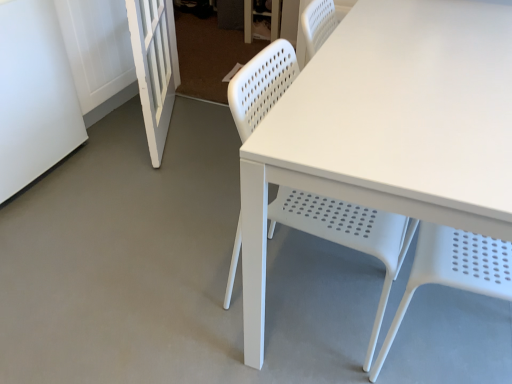
This screenshot has height=384, width=512. What are the coordinates of `white plastic chair at center` in the screenshot? It's located at (349, 235).

Find the location of a particular element. The image size is (512, 384). white matte screen door at left, positioned as the second screen door in left-to-right order is located at coordinates (154, 67).

Is point (285, 78) positioned after point (39, 109)?

No, it is in front of (39, 109).

From the image's perspective, does white plastic chair at center appear lower than white matte screen door at left, the first screen door positioned from the left?

Indeed, from the image's perspective, white plastic chair at center is shown beneath white matte screen door at left, the first screen door positioned from the left.

From a real-world perspective, is white plastic chair at center above or below white matte screen door at left, the first screen door positioned from the left?

white plastic chair at center is situated higher than white matte screen door at left, the first screen door positioned from the left, in the real world.

Does white plastic chair at center appear on the left side of white matte screen door at left, which appears as the 2th screen door when viewed from the right?

No.

Relative to white plastic chair at center, is white matte screen door at left, positioned as the second screen door in left-to-right order, in front or behind?

In the image, white matte screen door at left, positioned as the second screen door in left-to-right order, appears behind white plastic chair at center.

What's the angular difference between white matte screen door at left, the 1th screen door viewed from the right, and white plastic chair at center's facing directions?

The angular difference between white matte screen door at left, the 1th screen door viewed from the right, and white plastic chair at center is 24.4 degrees.

Based on the photo, from a real-world perspective, is white matte screen door at left, the 1th screen door viewed from the right, below white plastic chair at center?

Yes.

Does white matte screen door at left, the 1th screen door viewed from the right, touch white plastic chair at center?

They are not placed beside each other.

Is white matte screen door at left, the first screen door positioned from the left, closer to camera compared to white matte screen door at left, the 1th screen door viewed from the right?

Yes.

Measure the distance from white matte screen door at left, which appears as the 2th screen door when viewed from the right, to white matte screen door at left, positioned as the second screen door in left-to-right order.

white matte screen door at left, which appears as the 2th screen door when viewed from the right, and white matte screen door at left, positioned as the second screen door in left-to-right order, are 17.37 inches apart.

Does white matte screen door at left, the first screen door positioned from the left, have a smaller size compared to white matte screen door at left, the 1th screen door viewed from the right?

No, white matte screen door at left, the first screen door positioned from the left, is not smaller than white matte screen door at left, the 1th screen door viewed from the right.

From the image's perspective, does white matte screen door at left, which appears as the 2th screen door when viewed from the right, appear higher than white matte screen door at left, positioned as the second screen door in left-to-right order?

No, from the image's perspective, white matte screen door at left, which appears as the 2th screen door when viewed from the right, is not above white matte screen door at left, positioned as the second screen door in left-to-right order.

Does point (145, 92) come farther from viewer compared to point (11, 127)?

Yes, it is.

Based on the photo, would you say white matte screen door at left, positioned as the second screen door in left-to-right order, contains white matte screen door at left, the first screen door positioned from the left?

No, white matte screen door at left, positioned as the second screen door in left-to-right order, does not contain white matte screen door at left, the first screen door positioned from the left.

Is white matte screen door at left, the 1th screen door viewed from the right, turned away from white matte screen door at left, which appears as the 2th screen door when viewed from the right?

Absolutely, white matte screen door at left, the 1th screen door viewed from the right, is directed away from white matte screen door at left, which appears as the 2th screen door when viewed from the right.

Measure the distance between white matte screen door at left, the 1th screen door viewed from the right, and white matte screen door at left, the first screen door positioned from the left.

They are 17.37 inches apart.

Considering the points (292, 75) and (161, 115), which point is behind, point (292, 75) or point (161, 115)?

The point (161, 115) is farther.

Does white plastic chair at center have a smaller size compared to white matte screen door at left, positioned as the second screen door in left-to-right order?

Actually, white plastic chair at center might be larger than white matte screen door at left, positioned as the second screen door in left-to-right order.

Considering the positions of objects white plastic chair at center and white matte screen door at left, the 1th screen door viewed from the right, in the image provided, who is more to the left, white plastic chair at center or white matte screen door at left, the 1th screen door viewed from the right,?

Positioned to the left is white matte screen door at left, the 1th screen door viewed from the right.

Is white plastic chair at center outside of white matte screen door at left, positioned as the second screen door in left-to-right order?

Yes, white plastic chair at center is outside of white matte screen door at left, positioned as the second screen door in left-to-right order.

Image resolution: width=512 pixels, height=384 pixels. I want to click on chair on the right of white matte screen door at left, which appears as the 2th screen door when viewed from the right, so click(349, 235).

Relative to white plastic chair at center, is white matte screen door at left, which appears as the 2th screen door when viewed from the right, in front or behind?

Clearly, white matte screen door at left, which appears as the 2th screen door when viewed from the right, is behind white plastic chair at center.

Does point (78, 139) come closer to viewer compared to point (308, 193)?

No, it is not.

Considering the relative sizes of white matte screen door at left, the first screen door positioned from the left, and white plastic chair at center in the image provided, is white matte screen door at left, the first screen door positioned from the left, taller than white plastic chair at center?

In fact, white matte screen door at left, the first screen door positioned from the left, may be shorter than white plastic chair at center.

You are a GUI agent. You are given a task and a screenshot of the screen. Output one action in this format:
    pyautogui.click(x=<x>, y=<y>)
    Task: Click on the 1st screen door behind the white plastic chair at center
    This screenshot has height=384, width=512.
    Given the screenshot: What is the action you would take?
    pyautogui.click(x=34, y=95)

From a real-world perspective, which screen door is the 1st one underneath the white plastic chair at center? Please provide its 2D coordinates.

[(154, 67)]

Looking at the image, which one is located further to white matte screen door at left, positioned as the second screen door in left-to-right order, white plastic chair at center or white matte screen door at left, the first screen door positioned from the left?

Based on the image, white plastic chair at center appears to be further to white matte screen door at left, positioned as the second screen door in left-to-right order.

Considering their positions, is white matte screen door at left, the first screen door positioned from the left, positioned further to white plastic chair at center than white matte screen door at left, positioned as the second screen door in left-to-right order?

Based on the image, white matte screen door at left, the first screen door positioned from the left, appears to be further to white plastic chair at center.

Which object lies nearer to the anchor point white matte screen door at left, the 1th screen door viewed from the right, white matte screen door at left, which appears as the 2th screen door when viewed from the right, or white plastic chair at center?

Based on the image, white matte screen door at left, which appears as the 2th screen door when viewed from the right, appears to be nearer to white matte screen door at left, the 1th screen door viewed from the right.

Which object lies nearer to the anchor point white matte screen door at left, the first screen door positioned from the left, white plastic chair at center or white matte screen door at left, positioned as the second screen door in left-to-right order?

white matte screen door at left, positioned as the second screen door in left-to-right order, lies closer to white matte screen door at left, the first screen door positioned from the left, than the other object.

Considering their positions, is white matte screen door at left, positioned as the second screen door in left-to-right order, positioned closer to white matte screen door at left, the first screen door positioned from the left, than white plastic chair at center?

Based on the image, white matte screen door at left, positioned as the second screen door in left-to-right order, appears to be nearer to white matte screen door at left, the first screen door positioned from the left.

When comparing their distances from white plastic chair at center, does white matte screen door at left, the 1th screen door viewed from the right, or white matte screen door at left, the first screen door positioned from the left, seem closer?

The object closer to white plastic chair at center is white matte screen door at left, the 1th screen door viewed from the right.

Locate an element on the screen. This screenshot has height=384, width=512. screen door between white matte screen door at left, which appears as the 2th screen door when viewed from the right, and white plastic chair at center from left to right is located at coordinates (154, 67).